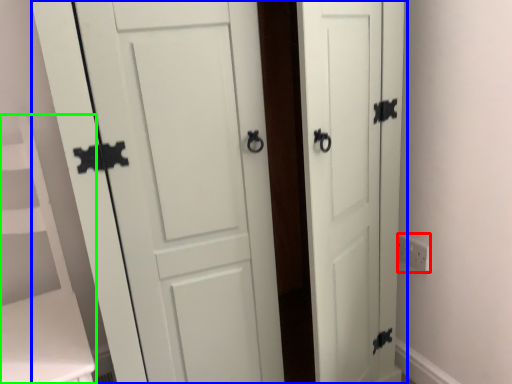
Question: Considering the real-world distances, which object is closest to electric outlet (highlighted by a red box)? door (highlighted by a blue box) or vanity (highlighted by a green box).

Choices:
 (A) door
 (B) vanity

Answer: (A)